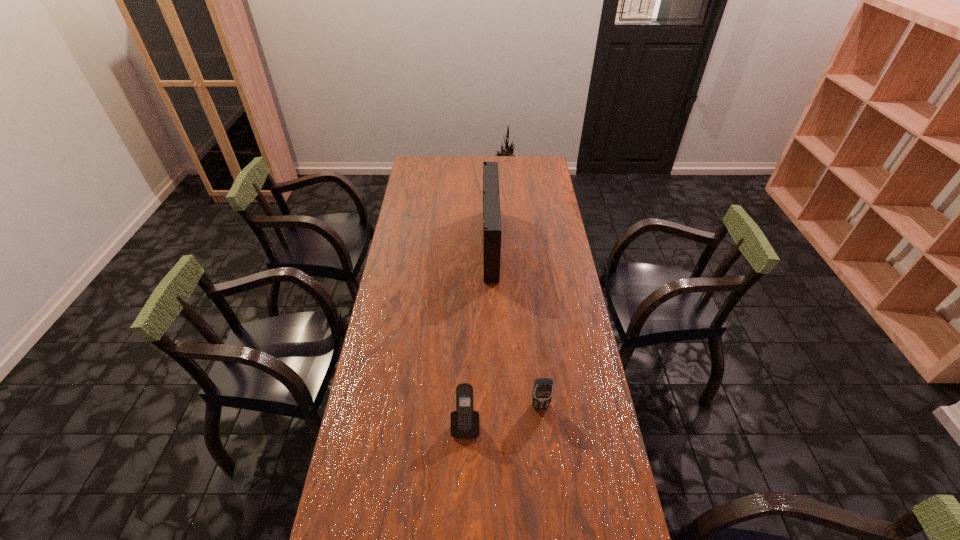
Where is `free space located on the front face of the right cellular telephone`? This screenshot has height=540, width=960. free space located on the front face of the right cellular telephone is located at coordinates (544, 444).

The image size is (960, 540). Find the location of `object located at the right edge`. object located at the right edge is located at coordinates (542, 393).

The height and width of the screenshot is (540, 960). In order to click on vacant point at the left edge in this screenshot , I will do `click(408, 315)`.

This screenshot has height=540, width=960. In the image, there is a desktop. Find the location of `vacant space at the right edge`. vacant space at the right edge is located at coordinates (577, 330).

Find the location of a particular element. The image size is (960, 540). vacant space at the far left corner of the desktop is located at coordinates (426, 157).

You are a GUI agent. You are given a task and a screenshot of the screen. Output one action in this format:
    pyautogui.click(x=<x>, y=<y>)
    Task: Click on the free point between the shortest object and the nearer cellular telephone
    
    Given the screenshot: What is the action you would take?
    pyautogui.click(x=503, y=415)

Find the location of a particular element. vacant region between the second nearest object and the farthest object is located at coordinates (516, 325).

Find the location of a particular element. This screenshot has height=540, width=960. vacant area that lies between the leftmost object and the tallest object is located at coordinates (478, 335).

Where is `vacant area that lies between the nearer cellular telephone and the farthest object`? This screenshot has width=960, height=540. vacant area that lies between the nearer cellular telephone and the farthest object is located at coordinates (478, 335).

In order to click on empty location between the nearest object and the rightmost object in this screenshot , I will do `click(503, 415)`.